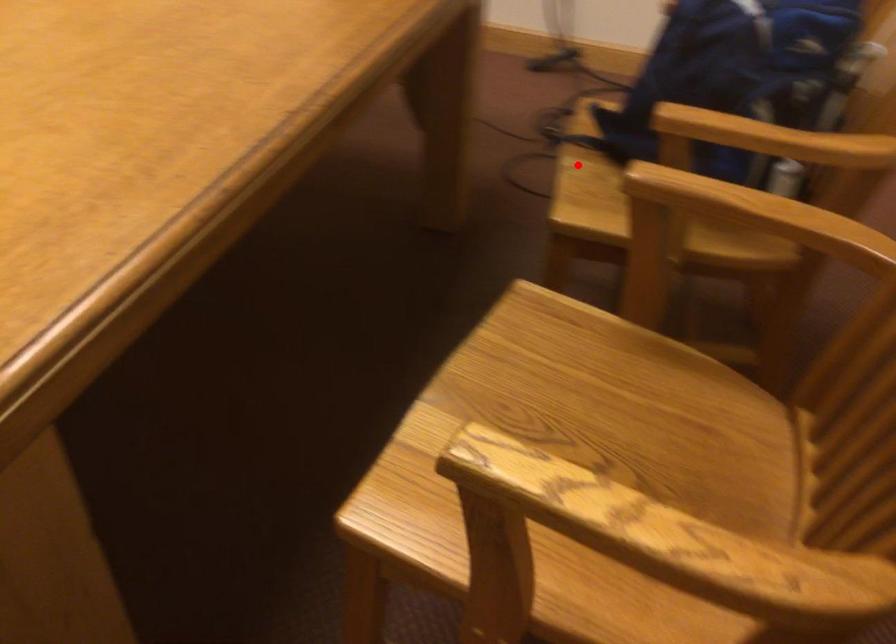
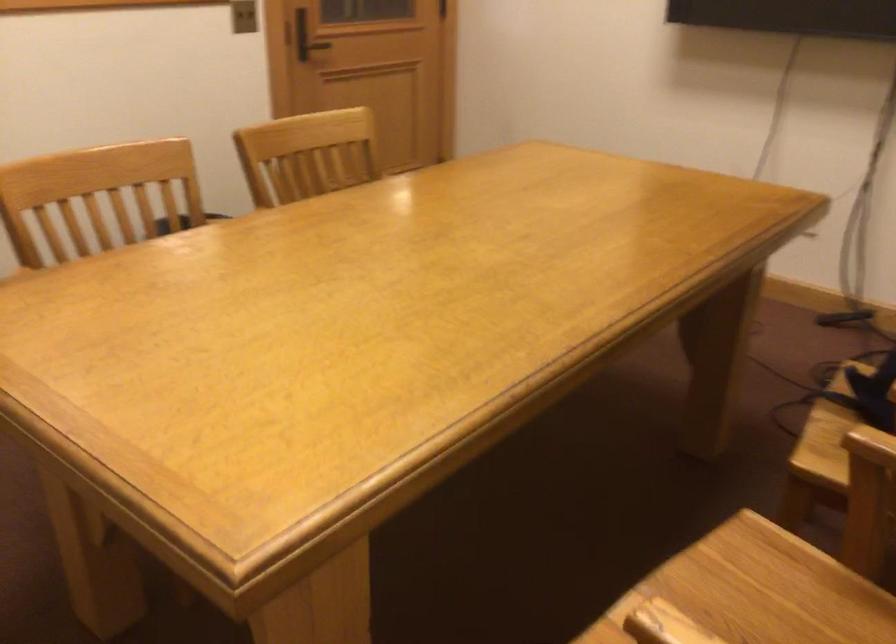
Find the pixel in the second image that matches the highlighted location in the first image.

(823, 419)